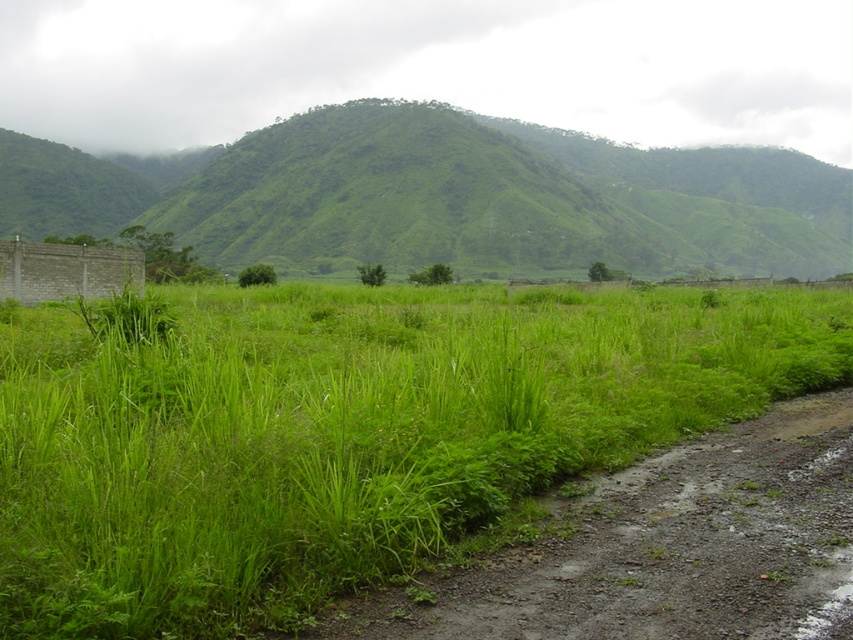
Question: Which of the following is the closest to the observer?

Choices:
 (A) (576, 602)
 (B) (106, 476)
 (C) (357, 188)

Answer: (A)

Question: Is green grassy field at center wider than damp gravel path at lower right?

Choices:
 (A) no
 (B) yes

Answer: (B)

Question: Is green grassy field at center wider than damp gravel path at lower right?

Choices:
 (A) yes
 (B) no

Answer: (A)

Question: Among these objects, which one is nearest to the camera?

Choices:
 (A) green grassy hill at left
 (B) damp gravel path at lower right
 (C) green grassy field at center

Answer: (C)

Question: Which point is closer to the camera taking this photo?

Choices:
 (A) (785, 598)
 (B) (123, 632)

Answer: (B)

Question: Does green grassy field at center appear on the right side of green grassy hill at left?

Choices:
 (A) no
 (B) yes

Answer: (B)